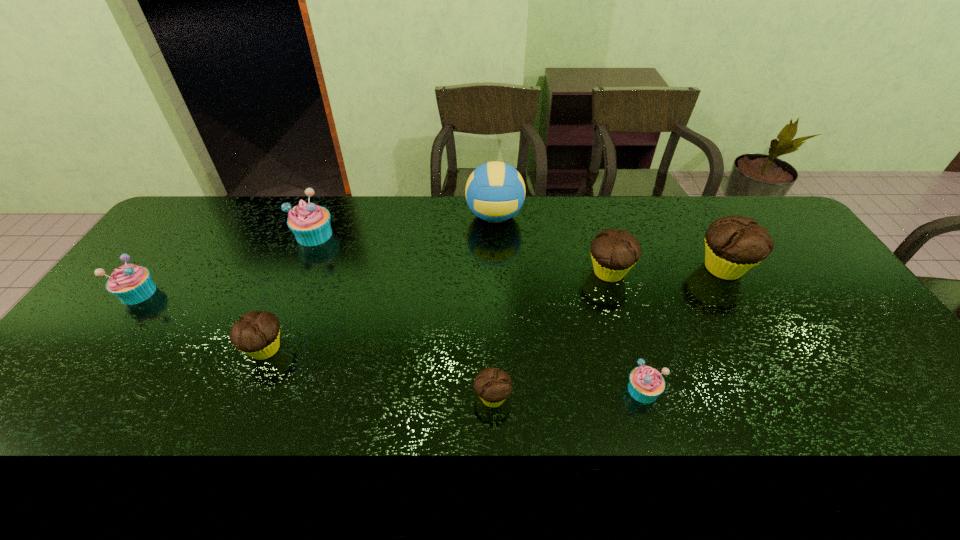
Locate which object ranks fifth in proximity to the second farthest blue muffin. Please provide its 2D coordinates. Your answer should be formatted as a tuple, i.e. [(x, y)], where the tuple contains the x and y coordinates of a point satisfying the conditions above.

[(614, 253)]

Choose which muffin is the fourth nearest neighbor to the leftmost chocolate muffin. Please provide its 2D coordinates. Your answer should be formatted as a tuple, i.e. [(x, y)], where the tuple contains the x and y coordinates of a point satisfying the conditions above.

[(614, 253)]

Identify the location of muffin that is the closest one to the leftmost chocolate muffin. The image size is (960, 540). (310, 223).

Locate an element on the screen. chocolate muffin that is the second closest to the third biggest chocolate muffin is located at coordinates (614, 253).

Locate an element on the screen. The height and width of the screenshot is (540, 960). chocolate muffin that can be found as the closest to the smallest chocolate muffin is located at coordinates (614, 253).

Identify which blue muffin is the second closest to the nearest blue muffin. Please provide its 2D coordinates. Your answer should be formatted as a tuple, i.e. [(x, y)], where the tuple contains the x and y coordinates of a point satisfying the conditions above.

[(131, 284)]

Find the location of `blue muffin that is the second closest to the nearest chocolate muffin`. blue muffin that is the second closest to the nearest chocolate muffin is located at coordinates click(x=310, y=223).

Image resolution: width=960 pixels, height=540 pixels. In order to click on blank space that satisfies the following two spatial constraints: 1. on the back side of the rightmost object; 2. on the right side of the smallest blue muffin in this screenshot , I will do `click(607, 268)`.